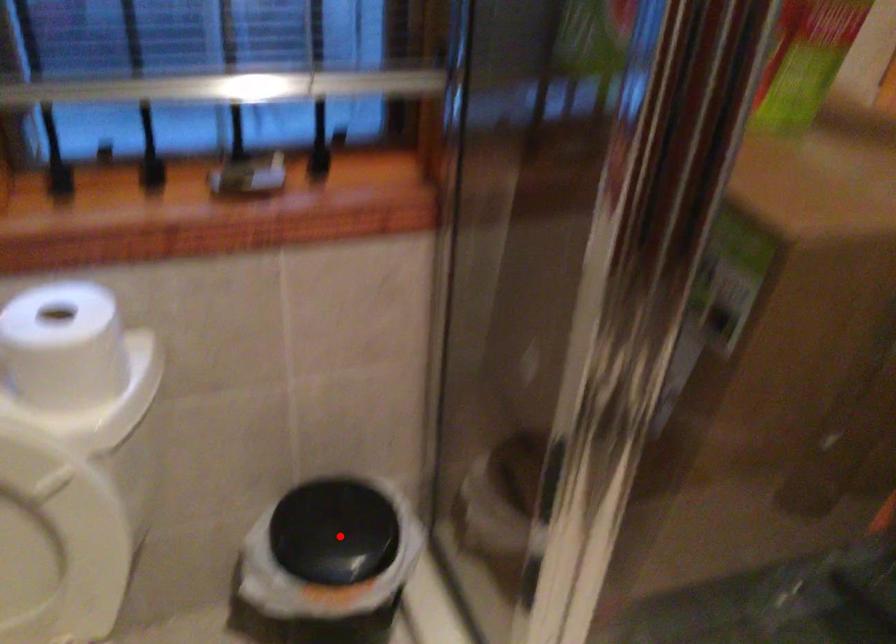
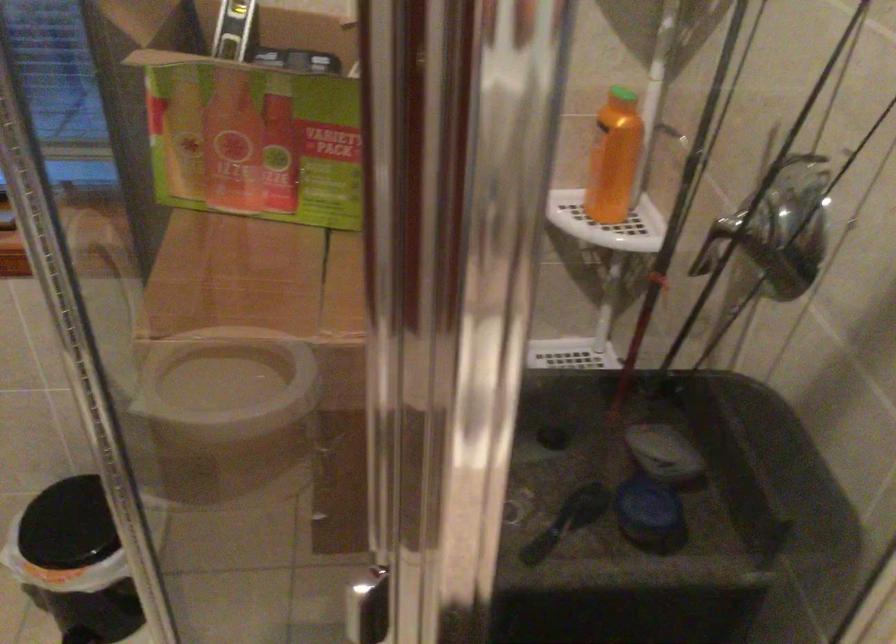
Question: I am providing you with two images of the same scene from different viewpoints. Image1 has a red point marked. In image2, the corresponding 3D location appears at what relative position? Reply with the corresponding letter.

Choices:
 (A) Closer
 (B) Farther

Answer: (B)